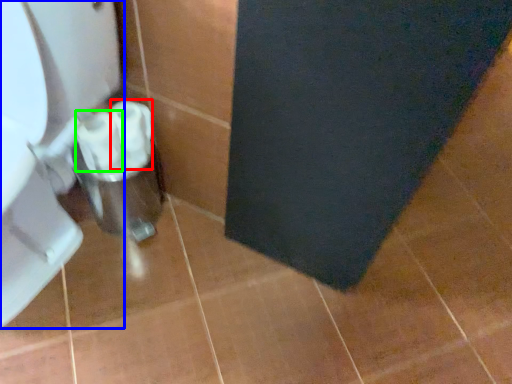
Question: Which object is positioned closest to toilet paper (highlighted by a red box)? Select from toilet (highlighted by a blue box) and toilet paper (highlighted by a green box).

Choices:
 (A) toilet
 (B) toilet paper

Answer: (B)